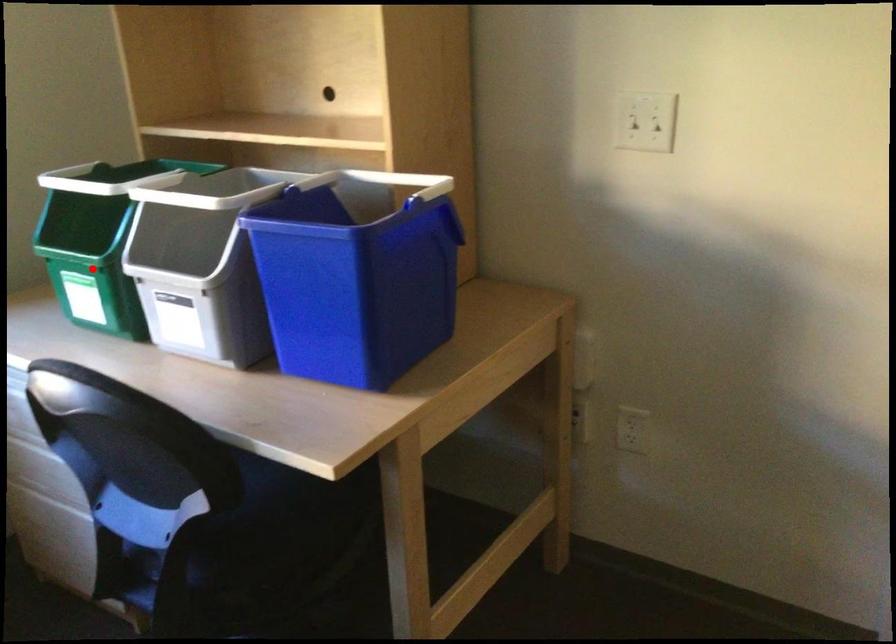
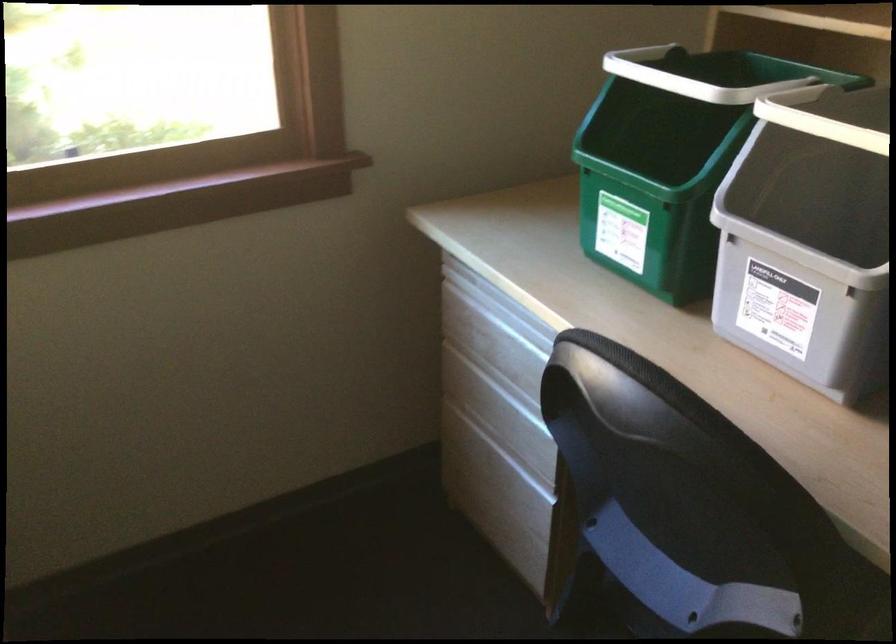
The point at the highlighted location is marked in the first image. Where is the corresponding point in the second image?

(652, 194)